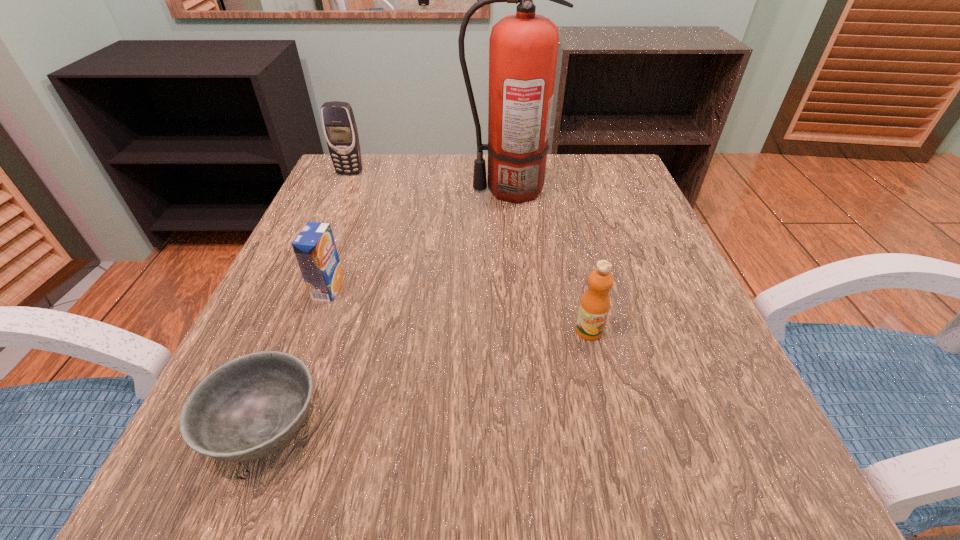
The height and width of the screenshot is (540, 960). I want to click on free spot between the bowl and the fire extinguisher, so click(x=388, y=308).

Locate an element on the screen. The height and width of the screenshot is (540, 960). empty space between the second nearest object and the tallest object is located at coordinates (549, 260).

You are a GUI agent. You are given a task and a screenshot of the screen. Output one action in this format:
    pyautogui.click(x=<x>, y=<y>)
    Task: Click on the vacant space in between the bowl and the fire extinguisher
    Image resolution: width=960 pixels, height=540 pixels.
    Given the screenshot: What is the action you would take?
    pyautogui.click(x=388, y=308)

At what (x,y) coordinates should I click in order to perform the action: click on free area in between the fire extinguisher and the third farthest object. Please return your answer as a coordinate pair (x, y). Image resolution: width=960 pixels, height=540 pixels. Looking at the image, I should click on (419, 239).

Identify the location of free space between the second nearest object and the fire extinguisher. (549, 260).

Locate an element on the screen. The height and width of the screenshot is (540, 960). free space between the second nearest object and the tallest object is located at coordinates (549, 260).

Where is `vacant point located between the fire extinguisher and the shortest object`? vacant point located between the fire extinguisher and the shortest object is located at coordinates (388, 308).

Where is `the fourth closest object to the fire extinguisher`? The height and width of the screenshot is (540, 960). the fourth closest object to the fire extinguisher is located at coordinates (249, 407).

Where is `the fourth closest object relative to the left orange_juice`? the fourth closest object relative to the left orange_juice is located at coordinates (594, 307).

The image size is (960, 540). I want to click on free region that satisfies the following two spatial constraints: 1. on the nozzle of the tallest object; 2. on the front side of the nearest object, so click(531, 428).